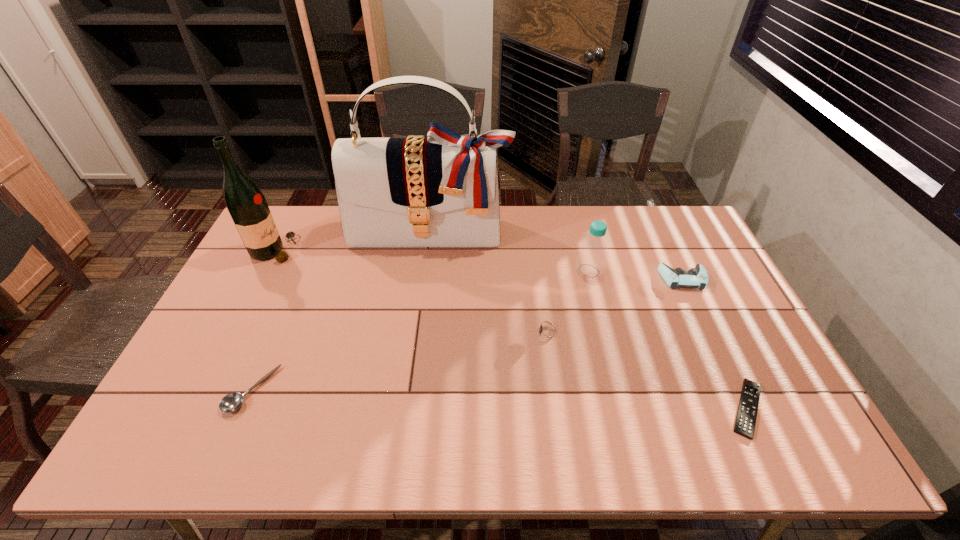
I want to click on vacant space at the right edge of the desktop, so click(708, 359).

This screenshot has width=960, height=540. I want to click on free space at the near left corner, so click(x=141, y=457).

This screenshot has height=540, width=960. Identify the location of unoccupied position between the remote control and the control. (715, 343).

The width and height of the screenshot is (960, 540). Identify the location of free point between the fourth tallest object and the ladle. (468, 334).

The width and height of the screenshot is (960, 540). Identify the location of empty location between the third nearest object and the second tallest object. (411, 292).

Identify the location of free space between the satchel and the remote control. (588, 321).

What are the coordinates of `free space between the fourth shortest object and the remote control` in the screenshot? It's located at (715, 343).

I want to click on unoccupied area between the shortest object and the ladle, so click(x=499, y=399).

This screenshot has width=960, height=540. Find the location of `vacant space that's between the second shortest object and the remote control`. vacant space that's between the second shortest object and the remote control is located at coordinates click(x=499, y=399).

The width and height of the screenshot is (960, 540). In order to click on empty location between the bottle and the fourth shortest object in this screenshot , I will do pos(636,275).